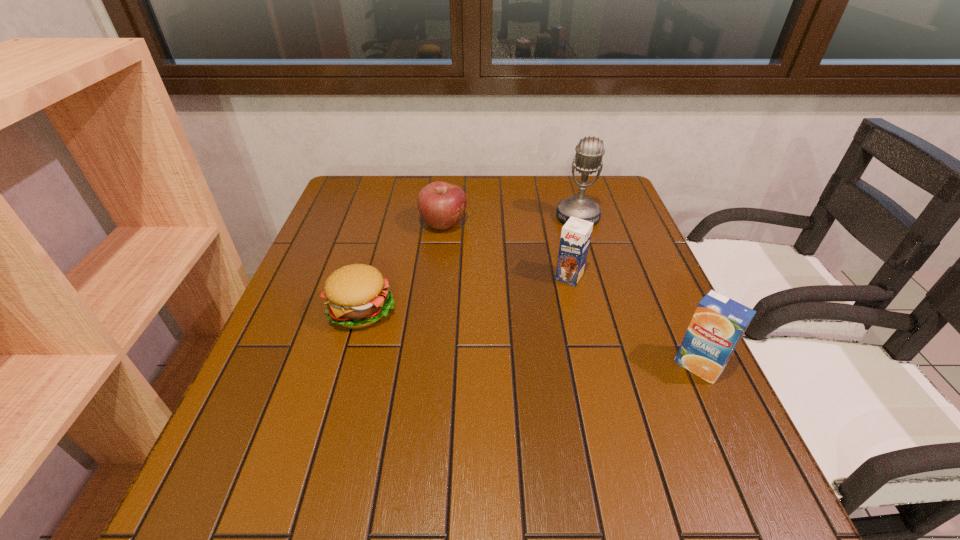
Locate an element on the screen. The height and width of the screenshot is (540, 960). orange_juice that is positioned at the right edge is located at coordinates (718, 324).

I want to click on microphone located at the right edge, so 589,152.

You are a GUI agent. You are given a task and a screenshot of the screen. Output one action in this format:
    pyautogui.click(x=<x>, y=<y>)
    Task: Click on the object that is at the far right corner
    This screenshot has width=960, height=540.
    Given the screenshot: What is the action you would take?
    pyautogui.click(x=589, y=152)

The width and height of the screenshot is (960, 540). I want to click on free space at the far edge of the desktop, so (x=412, y=201).

The width and height of the screenshot is (960, 540). In the image, there is a desktop. In order to click on vacant space at the near edge in this screenshot , I will do `click(493, 415)`.

Find the location of `free space at the left edge`. free space at the left edge is located at coordinates (265, 371).

Find the location of a particular element. The height and width of the screenshot is (540, 960). vacant space at the right edge of the desktop is located at coordinates (613, 255).

In the image, there is a desktop. What are the coordinates of `free space at the far left corner` in the screenshot? It's located at (371, 181).

Locate an element on the screen. vacant space at the near left corner of the desktop is located at coordinates (267, 414).

Identify the location of free point between the leftmost object and the second object from left to right. Image resolution: width=960 pixels, height=540 pixels. (402, 267).